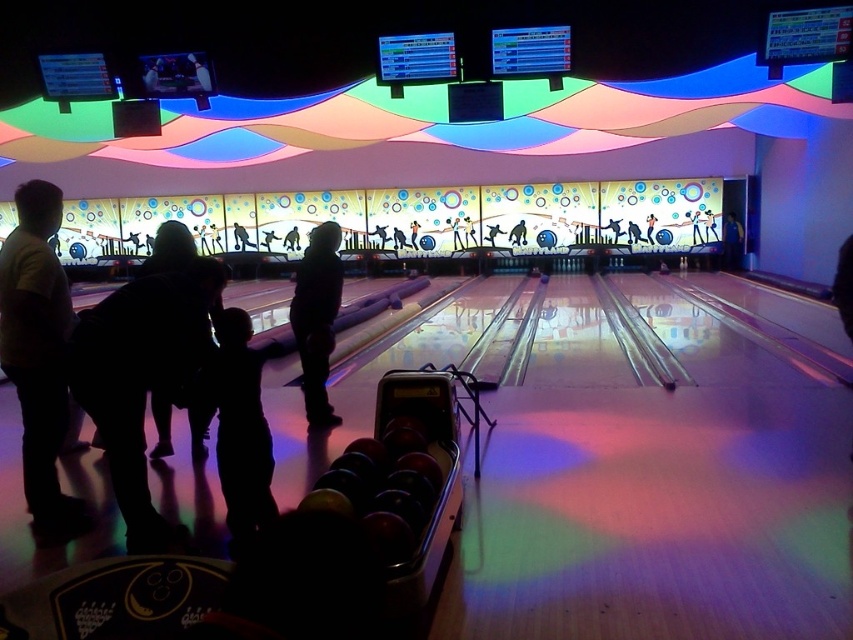
In the scene shown: You are standing at the center of the bowling alley and want to find the black matte bowling ball at left. According to the scene description, where should you look relative to your position?

The black matte bowling ball at left is located at the left side of the scene, so you should look to your left relative to your central position.